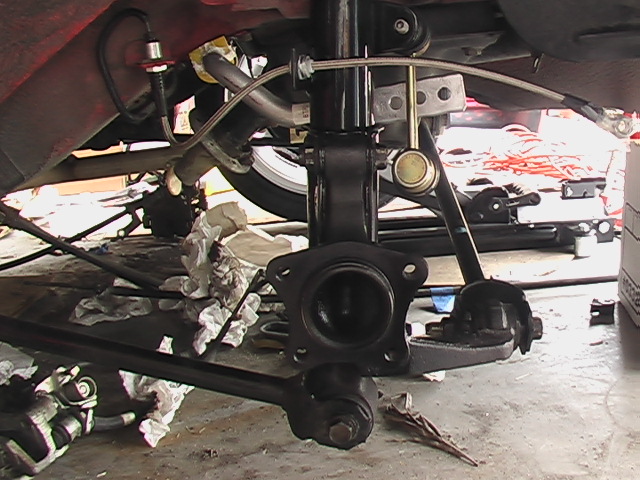
You are a GUI agent. You are given a task and a screenshot of the screen. Output one action in this format:
    pyautogui.click(x=<x>, y=<y>)
    Task: Click on the bracket
    
    Given the screenshot: What is the action you would take?
    pyautogui.click(x=160, y=85)